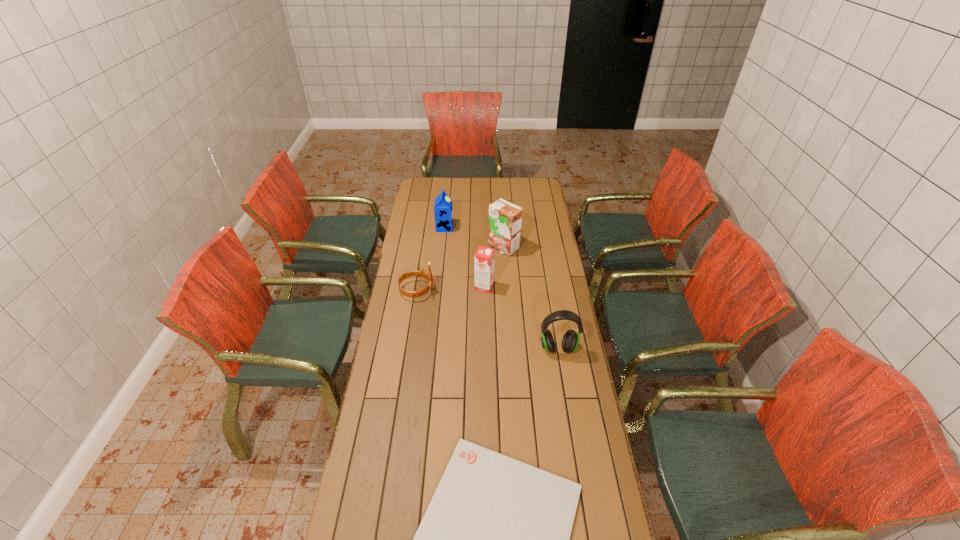
At what (x,y) coordinates should I click in order to perform the action: click on the second farthest carton. Please return your answer as a coordinate pair (x, y). The width and height of the screenshot is (960, 540). Looking at the image, I should click on [505, 219].

Locate an element on the screen. The image size is (960, 540). the leftmost carton is located at coordinates (443, 211).

Find the location of `the farthest object`. the farthest object is located at coordinates (443, 211).

Find the location of a particular element. the nearest carton is located at coordinates (484, 258).

Locate an element on the screen. headset is located at coordinates (570, 342).

The image size is (960, 540). I want to click on tiara, so click(418, 293).

This screenshot has height=540, width=960. In order to click on vacant space located on the straw side of the second nearest carton in this screenshot , I will do `click(506, 286)`.

What are the coordinates of `free space located with the cap open on the farthest carton` in the screenshot? It's located at (487, 227).

At what (x,y) coordinates should I click in order to perform the action: click on vacant space located 0.340m on the left of the nearest carton. Please return your answer as a coordinate pair (x, y). The image size is (960, 540). Looking at the image, I should click on (401, 286).

You are a GUI agent. You are given a task and a screenshot of the screen. Output one action in this format:
    pyautogui.click(x=<x>, y=<y>)
    Task: Click on the blank space located 0.280m on the ear cups of the fifth farthest object
    This screenshot has width=960, height=540.
    Given the screenshot: What is the action you would take?
    pyautogui.click(x=570, y=423)